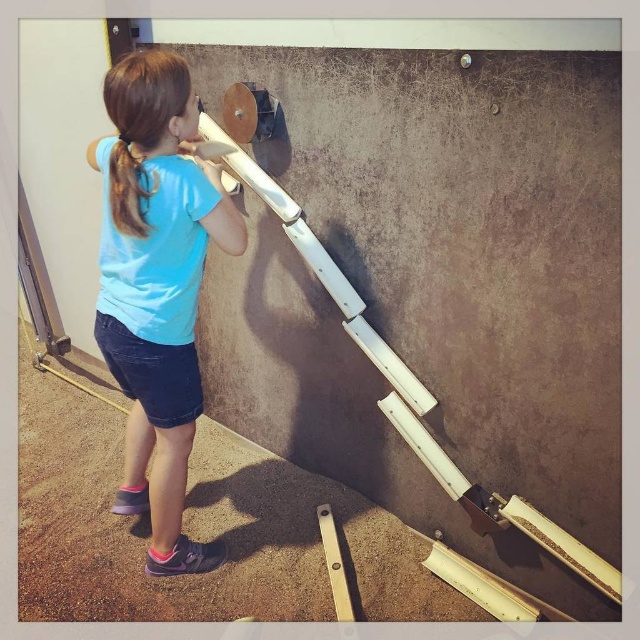
Does point (144, 301) come closer to viewer compared to point (122, 189)?

No, (144, 301) is behind (122, 189).

Can you confirm if blue fabric shirt at center is positioned below brown hair at upper left?

Indeed, blue fabric shirt at center is positioned under brown hair at upper left.

Between point (154, 132) and point (129, 211), which one is positioned behind?

The point (129, 211) is behind.

At what (x,y) coordinates should I click in order to perform the action: click on blue fabric shirt at center. Please return your answer as a coordinate pair (x, y). This screenshot has height=640, width=640. Looking at the image, I should click on (156, 285).